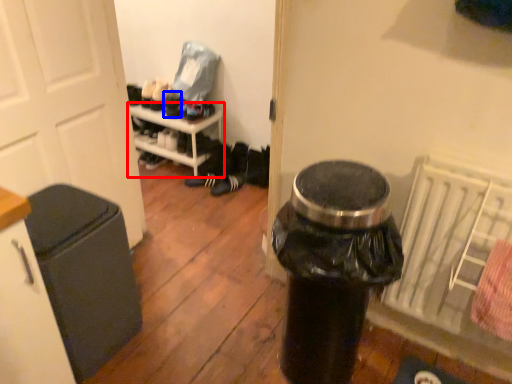
Question: Which of the following is the farthest to the observer, furniture (highlighted by a red box) or shoe (highlighted by a blue box)?

Choices:
 (A) furniture
 (B) shoe

Answer: (B)